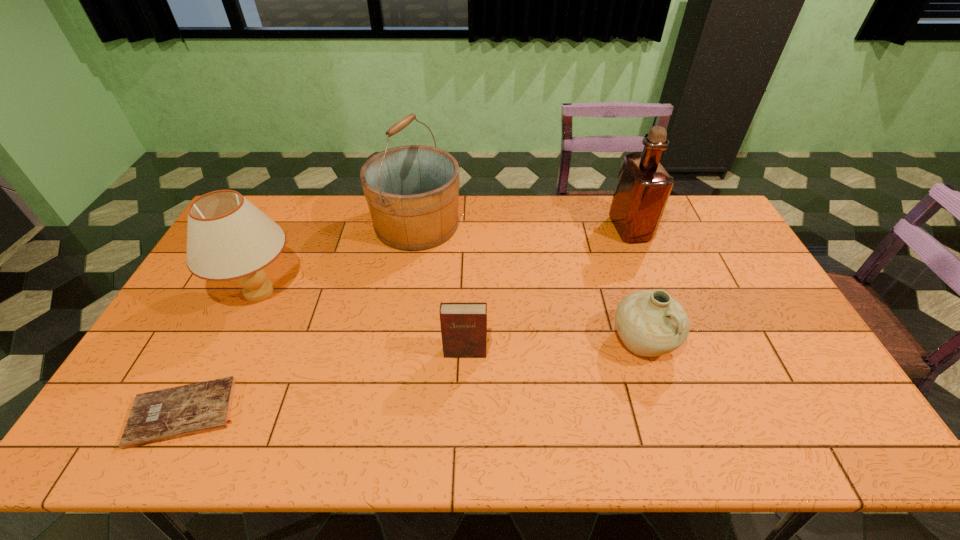
Where is `vacant point located between the diary and the bucket`? This screenshot has width=960, height=540. vacant point located between the diary and the bucket is located at coordinates (441, 288).

The image size is (960, 540). I want to click on free area in between the Bible and the liquor, so click(407, 321).

The image size is (960, 540). In order to click on vacant space in between the liquor and the Bible in this screenshot , I will do `click(407, 321)`.

I want to click on free point between the shortest object and the pottery, so click(x=414, y=376).

Identify which object is the closest to the pottery. Please provide its 2D coordinates. Your answer should be formatted as a tuple, i.e. [(x, y)], where the tuple contains the x and y coordinates of a point satisfying the conditions above.

[(643, 186)]

This screenshot has width=960, height=540. I want to click on the fourth closest object to the pottery, so click(x=228, y=238).

You are a GUI agent. You are given a task and a screenshot of the screen. Output one action in this format:
    pyautogui.click(x=<x>, y=<y>)
    Task: Click on the free location that satisfies the following two spatial constraints: 1. on the back side of the bucket; 2. on the left side of the Bible
    Image resolution: width=960 pixels, height=540 pixels.
    Given the screenshot: What is the action you would take?
    pyautogui.click(x=281, y=224)

The width and height of the screenshot is (960, 540). Identify the location of vacant area in the image that satisfies the following two spatial constraints: 1. on the front side of the pottery; 2. on the right side of the bucket. (397, 341).